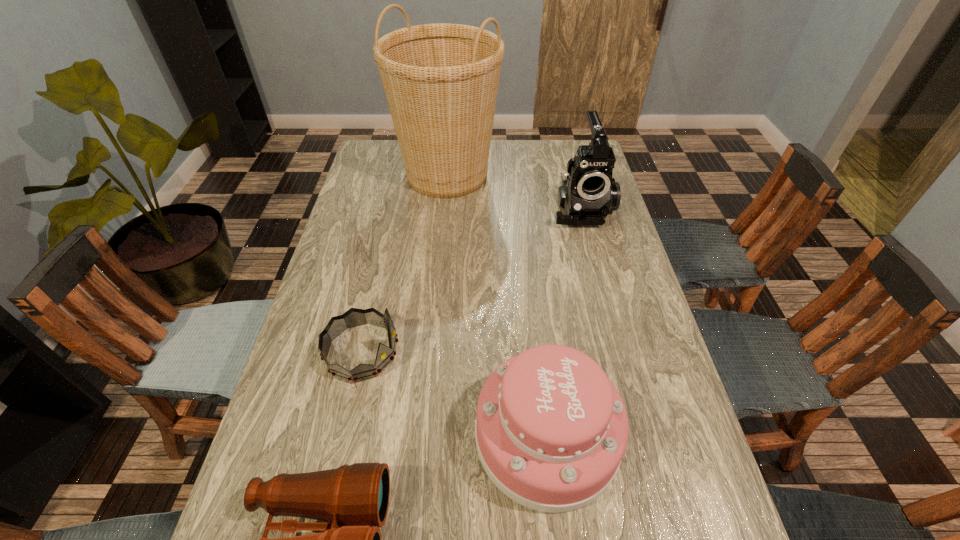
Locate an element on the screen. Image resolution: width=960 pixels, height=540 pixels. vacant space in between the tiara and the tallest object is located at coordinates (404, 263).

Where is `vacant area between the third shortest object and the tiara`? vacant area between the third shortest object and the tiara is located at coordinates (454, 394).

Select which object appears as the second closest to the birthday cake. Please provide its 2D coordinates. Your answer should be formatted as a tuple, i.e. [(x, y)], where the tuple contains the x and y coordinates of a point satisfying the conditions above.

[(353, 317)]

This screenshot has height=540, width=960. What are the coordinates of `the second closest object to the binoculars` in the screenshot? It's located at (353, 317).

In order to click on blank area in the image that satisfies the following two spatial constraints: 1. on the lens mount of the camcorder; 2. at the front of the tiara with jewels in this screenshot , I will do `click(619, 351)`.

This screenshot has height=540, width=960. Identify the location of blank area in the image that satisfies the following two spatial constraints: 1. at the front of the tiara with jewels; 2. on the right side of the birthday cake. (343, 436).

Identify the location of free location that satisfies the following two spatial constraints: 1. on the back side of the third tallest object; 2. at the front of the tiara with jewels. Image resolution: width=960 pixels, height=540 pixels. (538, 351).